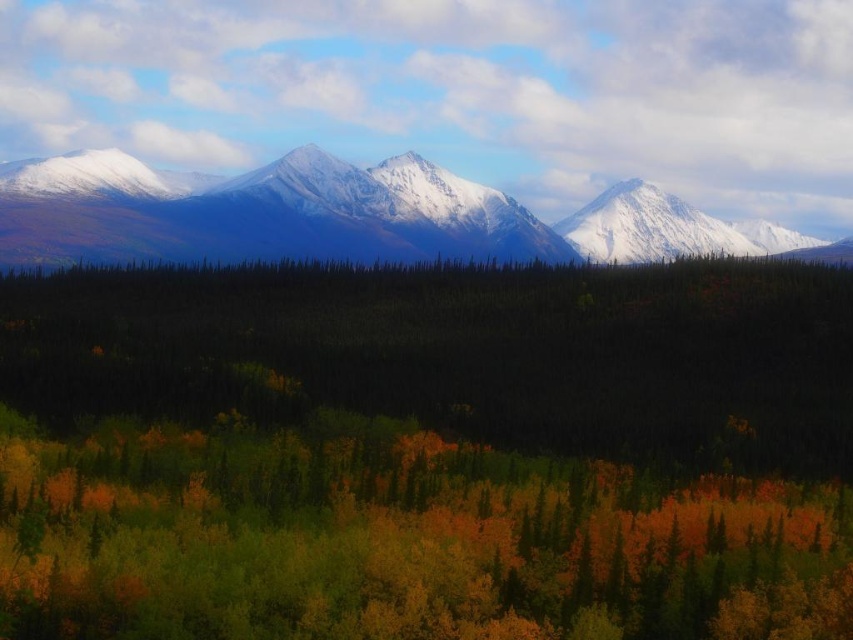
You are standing at the point with coordinates point (225, 182) and want to walk towards the mountains in the background. Is the point point (647, 547) blocking your path?

Point (647, 547) is in front of point (225, 182), so if you are standing at point (225, 182) and want to walk towards the mountains in the background, the point (647, 547) is actually in front of you and would block your path.

You are standing at the origin point in the image and want to reach the green matte forest at center. Which direction should you move in to get there?

The green matte forest at center is located at point 0.708 on the x and 0.502 on the y. Since you are at the origin, you should move to the right and slightly forward to reach it.

You are standing at the point marked as point (427, 452) in the image. What can you see directly in front of you?

You can see the green matte forest at center directly in front of you at point (427, 452).